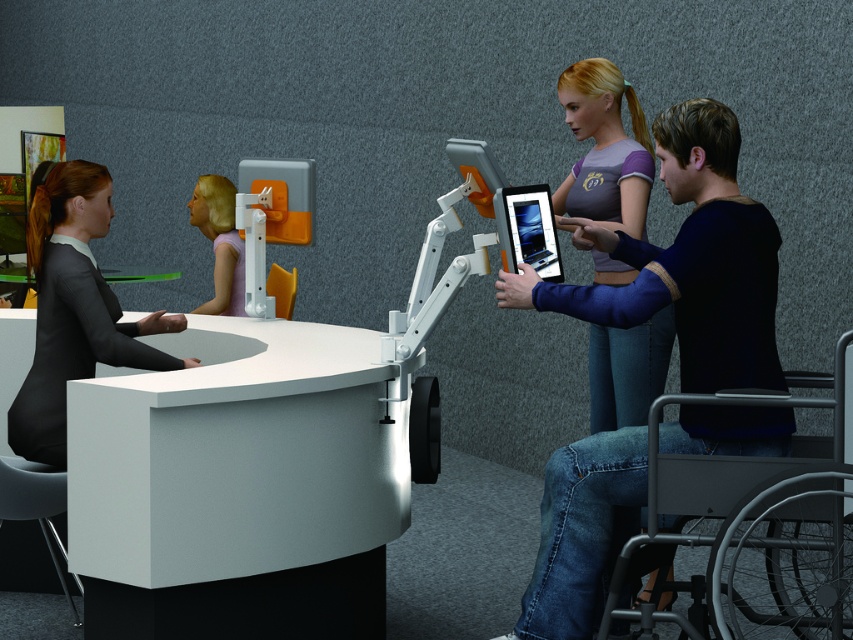
You are a visitor at this office and want to park your wheelchair near the desk. There are two wheelchairs already present, the metallic blue wheelchair at right and the silver metallic wheelchair at lower right. Which one is closer to the desk?

The metallic blue wheelchair at right is positioned on the left side of the silver metallic wheelchair at lower right, so the metallic blue wheelchair at right is closer to the desk.

You are a visitor at this office and need to find the metallic blue wheelchair at right and the silver metallic wheelchair at lower right. According to the scene description, which wheelchair is positioned higher up in the image?

The metallic blue wheelchair at right is positioned higher up in the image because it is above the silver metallic wheelchair at lower right.

You are a visitor in the office and need to place a 10 feet long banner between the white glossy information desk at left and the pastel purple fabric at upper center. Is there enough space?

The distance between the white glossy information desk at left and the pastel purple fabric at upper center is 9.30 feet, which is shorter than the banner length of 10 feet. Therefore, there isn not enough space to place the banner.